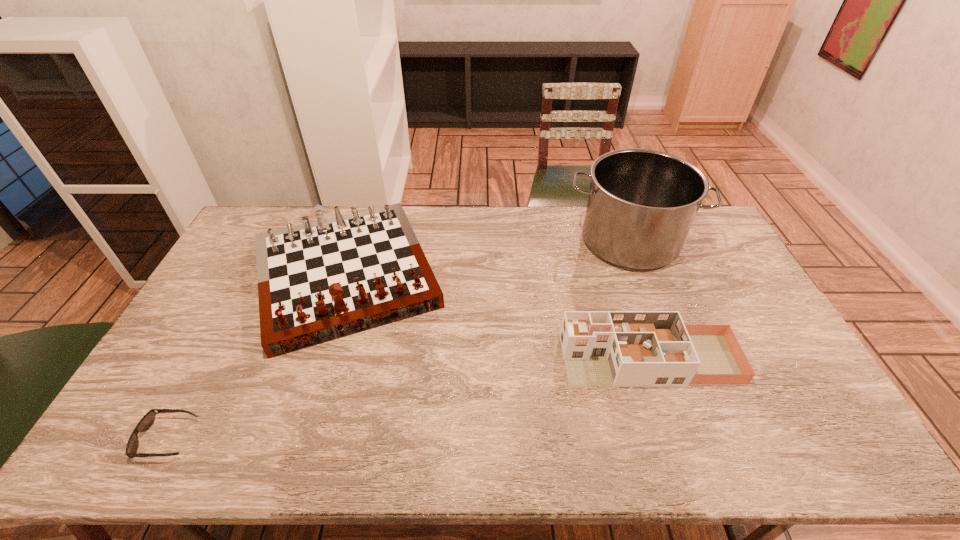
I want to click on free point between the third shortest object and the third tallest object, so click(497, 318).

Where is `free space that is in between the saucepan and the second tallest object`? The width and height of the screenshot is (960, 540). free space that is in between the saucepan and the second tallest object is located at coordinates (488, 258).

Image resolution: width=960 pixels, height=540 pixels. Identify the location of vacant area that lies between the tallest object and the second shortest object. (639, 300).

This screenshot has height=540, width=960. In order to click on free space between the third tallest object and the nearest object in this screenshot , I will do `click(408, 399)`.

Point out which object is positioned as the third nearest to the dollhouse. Please provide its 2D coordinates. Your answer should be formatted as a tuple, i.e. [(x, y)], where the tuple contains the x and y coordinates of a point satisfying the conditions above.

[(146, 422)]

Where is `object identified as the closest to the nearest object`? object identified as the closest to the nearest object is located at coordinates (319, 281).

Image resolution: width=960 pixels, height=540 pixels. Find the location of `vacant space that satisfies the following two spatial constraints: 1. on the front side of the gameboard; 2. on the front-facing side of the sunglasses`. vacant space that satisfies the following two spatial constraints: 1. on the front side of the gameboard; 2. on the front-facing side of the sunglasses is located at coordinates (295, 438).

Find the location of a particular element. The image size is (960, 540). vacant space that satisfies the following two spatial constraints: 1. on the back side of the saucepan; 2. on the right side of the second tallest object is located at coordinates (357, 241).